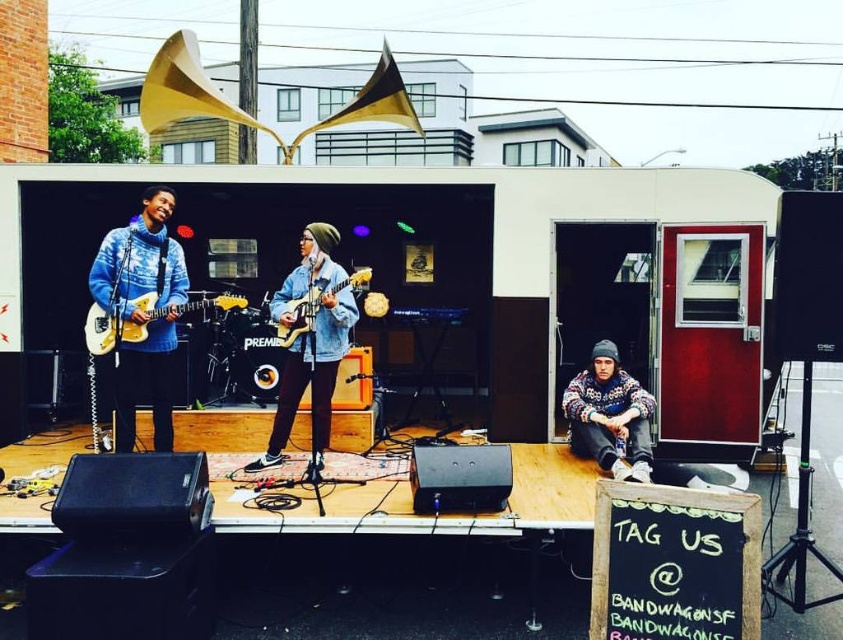
Question: Does tie-dye sweater at left have a smaller size compared to matte blue electric guitar at center?

Choices:
 (A) no
 (B) yes

Answer: (A)

Question: Which object appears farthest from the camera in this image?

Choices:
 (A) matte electric guitar at left
 (B) knitted sweater at lower right
 (C) matte blue electric guitar at center
 (D) tie-dye sweater at left

Answer: (D)

Question: Which object appears farthest from the camera in this image?

Choices:
 (A) tie-dye sweater at left
 (B) matte electric guitar at left
 (C) denim jacket at center
 (D) knitted sweater at lower right

Answer: (A)

Question: Which point appears farthest from the camera in this image?

Choices:
 (A) (212, 301)
 (B) (298, 372)
 (C) (627, 438)
 (D) (364, 268)

Answer: (D)

Question: From the image, what is the correct spatial relationship of denim jacket at center in relation to knitted sweater at lower right?

Choices:
 (A) above
 (B) below

Answer: (A)

Question: Can you confirm if knitted sweater at lower right is bigger than matte electric guitar at left?

Choices:
 (A) no
 (B) yes

Answer: (B)